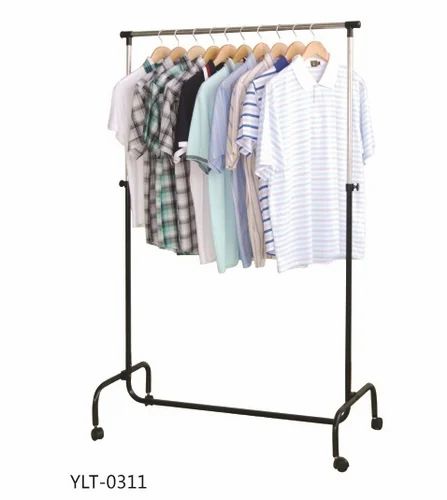
Locate an element on the screen. The image size is (447, 500). hanger hooks is located at coordinates (160, 40), (177, 43), (194, 35), (208, 38), (229, 39), (243, 37), (257, 37), (276, 36), (294, 32), (313, 34).